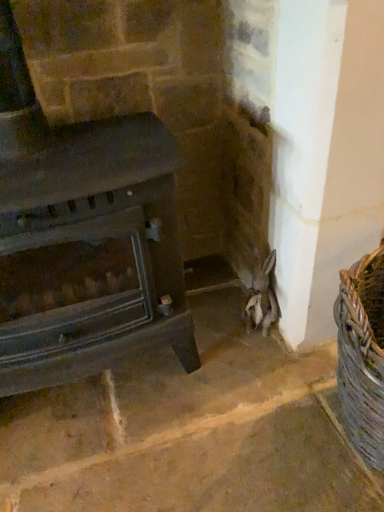
The height and width of the screenshot is (512, 384). Describe the element at coordinates (87, 231) in the screenshot. I see `dark gray stone wood burning stove at center` at that location.

Find the location of a particular element. The image size is (384, 512). dark gray stone wood burning stove at center is located at coordinates tap(87, 231).

What are the coordinates of `dark gray stone wood burning stove at center` in the screenshot? It's located at (87, 231).